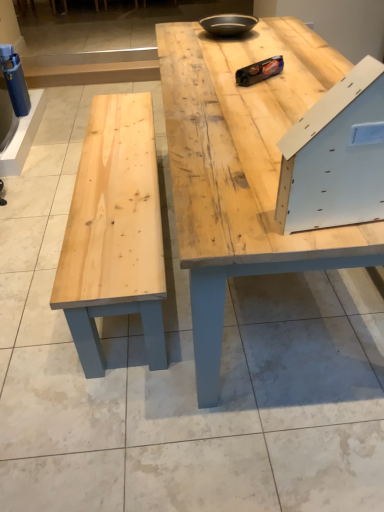
The height and width of the screenshot is (512, 384). I want to click on blank space above natural wood table at center (from a real-world perspective), so click(258, 52).